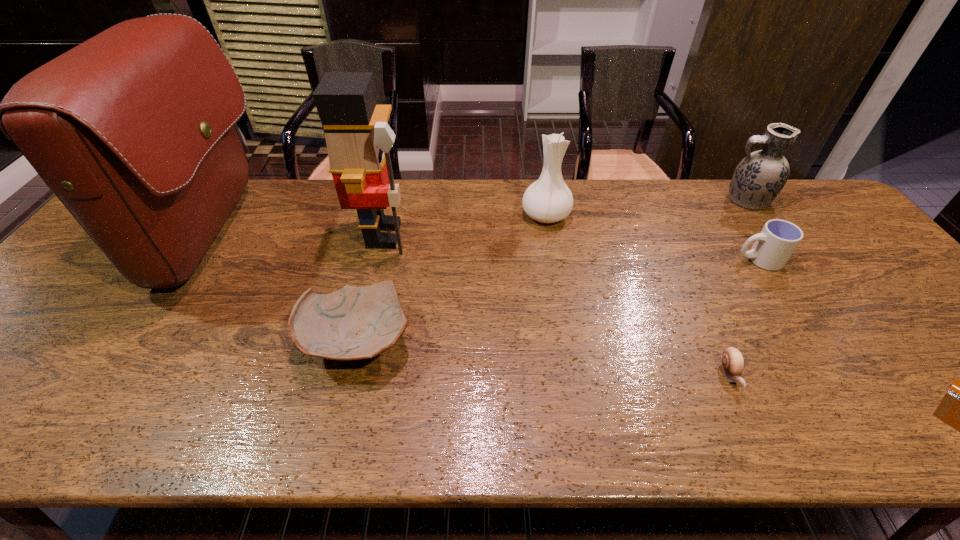
Locate an element on the screen. the leftmost object is located at coordinates (133, 130).

Locate an element on the screen. The height and width of the screenshot is (540, 960). the tallest object is located at coordinates (133, 130).

Where is `nutcracker`? This screenshot has width=960, height=540. nutcracker is located at coordinates (358, 138).

At what (x,y) coordinates should I click in order to perform the action: click on the fourth object from left to right. Please return your answer as a coordinate pair (x, y). Looking at the image, I should click on 547,200.

The width and height of the screenshot is (960, 540). Find the location of `the right vase`. the right vase is located at coordinates (758, 179).

Locate an element on the screen. cup is located at coordinates (774, 245).

This screenshot has width=960, height=540. I want to click on pottery, so click(x=353, y=323).

Where is `escargot`? Image resolution: width=960 pixels, height=540 pixels. escargot is located at coordinates (732, 360).

At what (x,y) coordinates should I click in order to perform the action: click on the fifth object from left to right. Please return your answer as a coordinate pair (x, y). This screenshot has height=540, width=960. Looking at the image, I should click on (732, 360).

The image size is (960, 540). Identify the location of free spot located 0.190m on the open flap of the tallest object. (326, 235).